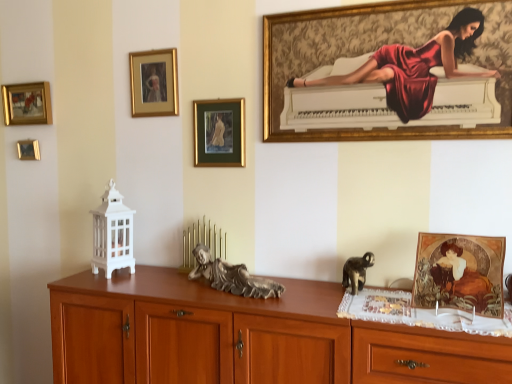
Where is `vacant area located to the right-hand side of shiny metallic cat at lower right, positioned as the 1th animal in right-to-left order`? Image resolution: width=512 pixels, height=384 pixels. vacant area located to the right-hand side of shiny metallic cat at lower right, positioned as the 1th animal in right-to-left order is located at coordinates (391, 293).